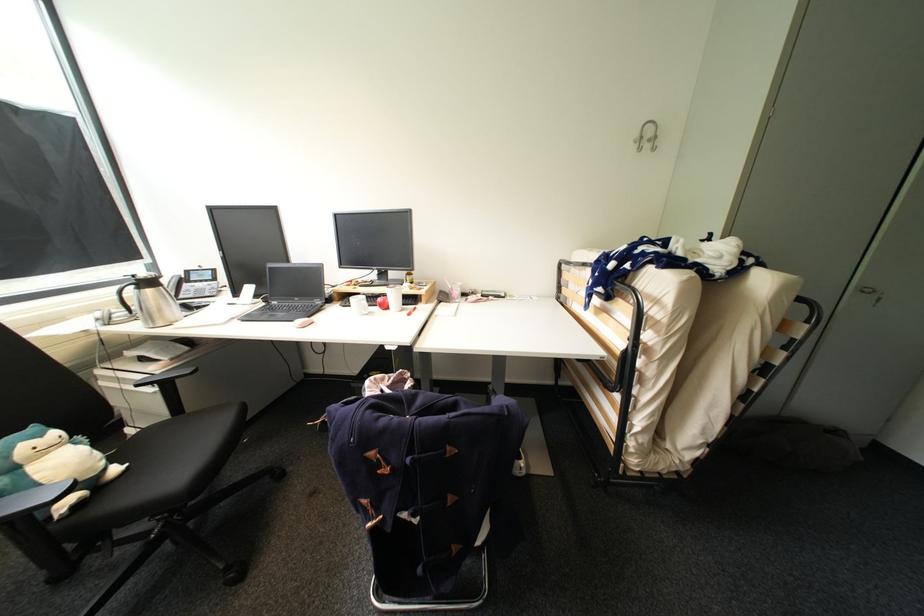
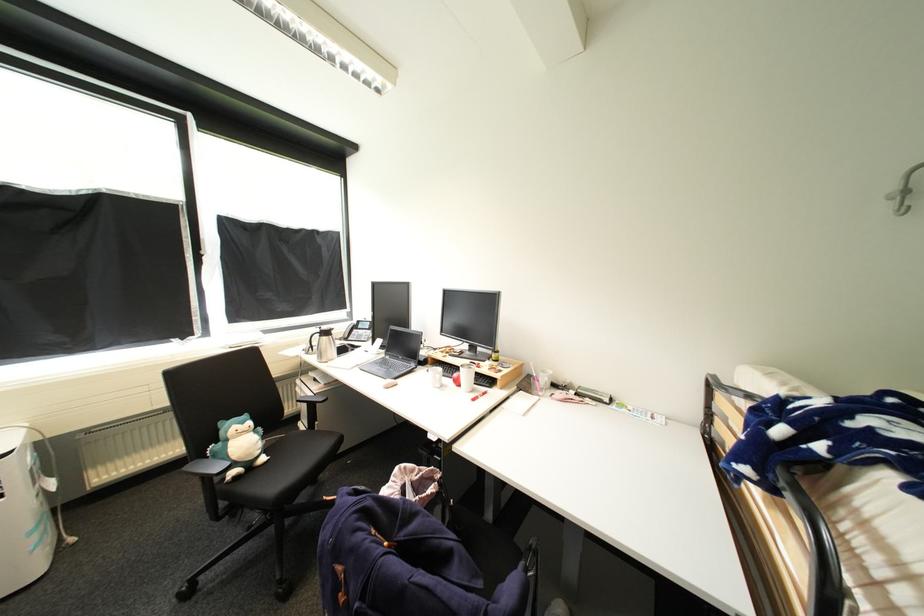
Find the pixel in the second image that matches point (124, 469) in the first image.

(270, 460)